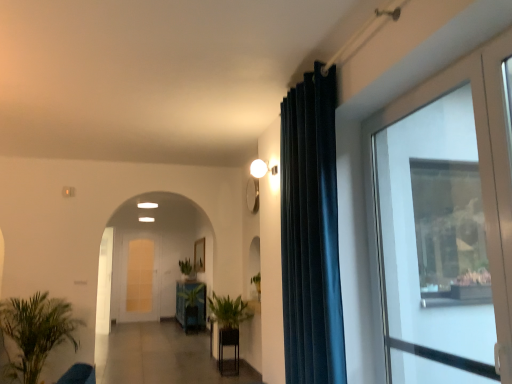
Question: From a real-world perspective, does green matte plant at center, the first houseplant in the right-to-left sequence, sit lower than green leafy plant at lower left, the first houseplant positioned from the left?

Choices:
 (A) yes
 (B) no

Answer: (B)

Question: Considering the relative positions of green matte plant at center, which is the third houseplant in left-to-right order, and green leafy plant at lower left, marked as the third houseplant in a right-to-left arrangement, in the image provided, is green matte plant at center, which is the third houseplant in left-to-right order, to the left of green leafy plant at lower left, marked as the third houseplant in a right-to-left arrangement, from the viewer's perspective?

Choices:
 (A) yes
 (B) no

Answer: (B)

Question: Is green matte plant at center, which is the third houseplant in left-to-right order, to the right of green leafy plant at lower left, marked as the third houseplant in a right-to-left arrangement, from the viewer's perspective?

Choices:
 (A) yes
 (B) no

Answer: (A)

Question: Can we say green matte plant at center, which is the third houseplant in left-to-right order, lies outside green leafy plant at lower left, the first houseplant positioned from the left?

Choices:
 (A) no
 (B) yes

Answer: (B)

Question: From the image's perspective, is green matte plant at center, the first houseplant in the right-to-left sequence, beneath green leafy plant at lower left, the first houseplant positioned from the left?

Choices:
 (A) yes
 (B) no

Answer: (B)

Question: Would you say green matte plant at center, the first houseplant in the right-to-left sequence, is a long distance from green leafy plant at lower left, marked as the third houseplant in a right-to-left arrangement?

Choices:
 (A) no
 (B) yes

Answer: (B)

Question: From the image's perspective, is white glossy door at center, which is the first screen door from front to back, on green matte plant at center, the first houseplant in the right-to-left sequence?

Choices:
 (A) yes
 (B) no

Answer: (B)

Question: Would you say white glossy door at center, which is the first screen door from front to back, is a long distance from green matte plant at center, which is the third houseplant in left-to-right order?

Choices:
 (A) no
 (B) yes

Answer: (B)

Question: Is white glossy door at center, which is the first screen door from front to back, wider than green matte plant at center, the first houseplant in the right-to-left sequence?

Choices:
 (A) yes
 (B) no

Answer: (B)

Question: From a real-world perspective, is white glossy door at center, which is the first screen door from front to back, positioned under green matte plant at center, which is the third houseplant in left-to-right order, based on gravity?

Choices:
 (A) no
 (B) yes

Answer: (A)

Question: Does white glossy door at center, which is the first screen door from front to back, have a greater height compared to green matte plant at center, the first houseplant in the right-to-left sequence?

Choices:
 (A) no
 (B) yes

Answer: (B)

Question: Is the depth of white glossy door at center, acting as the second screen door starting from the back, greater than that of green matte plant at center, which is the third houseplant in left-to-right order?

Choices:
 (A) yes
 (B) no

Answer: (A)

Question: Is green glossy plant pot at center, marked as the first furniture in a back-to-front arrangement, facing towards dark blue velvet curtain at center?

Choices:
 (A) no
 (B) yes

Answer: (A)